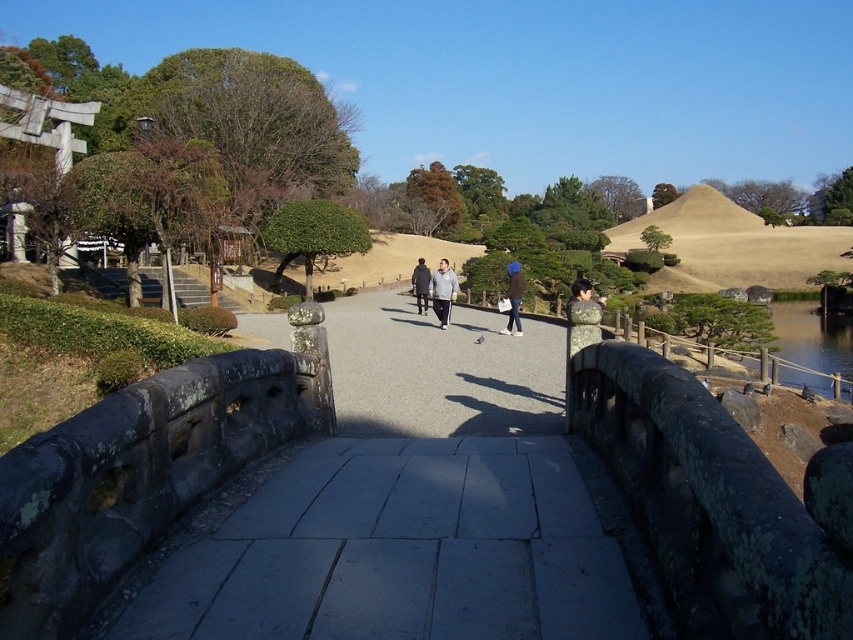
Question: Does blue fabric bag at center lie behind dark gray stone figure at center?

Choices:
 (A) no
 (B) yes

Answer: (A)

Question: Considering the relative positions of gray fabric jacket at center and matte gray stone statue at center in the image provided, where is gray fabric jacket at center located with respect to matte gray stone statue at center?

Choices:
 (A) right
 (B) left

Answer: (B)

Question: Considering the real-world distances, which object is closest to the matte gray stone statue at center?

Choices:
 (A) dark gray stone figure at center
 (B) blue fabric bag at center

Answer: (B)

Question: Estimate the real-world distances between objects in this image. Which object is farther from the gray fabric jacket at center?

Choices:
 (A) blue fabric bag at center
 (B) dark gray stone figure at center

Answer: (B)

Question: Based on their relative distances, which object is farther from the gray fabric jacket at center?

Choices:
 (A) blue fabric bag at center
 (B) dark gray stone figure at center
 (C) matte gray stone statue at center

Answer: (C)

Question: Is the position of blue fabric bag at center more distant than that of dark gray stone figure at center?

Choices:
 (A) yes
 (B) no

Answer: (B)